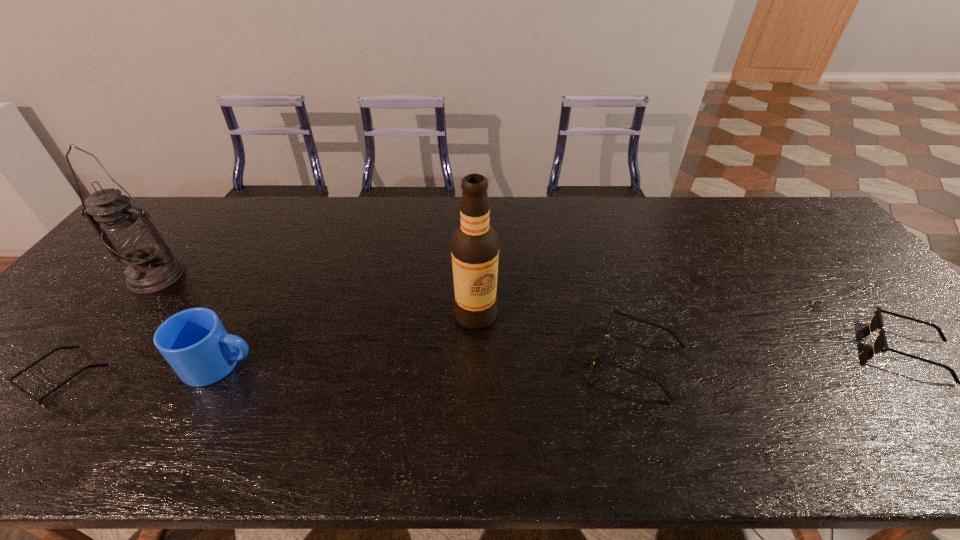
You are a GUI agent. You are given a task and a screenshot of the screen. Output one action in this format:
    pyautogui.click(x=<x>, y=<y>)
    Task: Click on the location for an additional sunglasses to make spacing equal
    The image size is (960, 540).
    Given the screenshot: What is the action you would take?
    pyautogui.click(x=356, y=368)